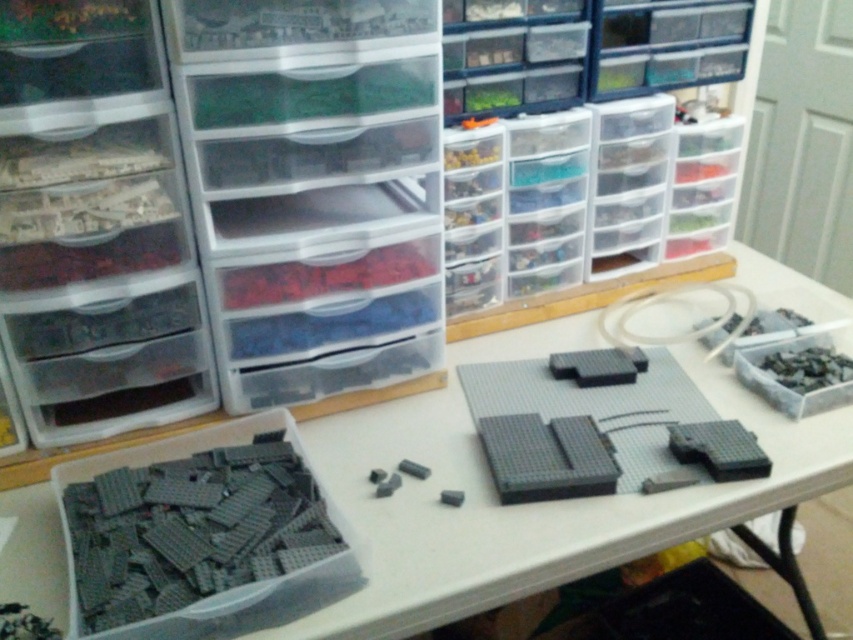
Question: Can you confirm if transparent plastic table at center is positioned below gray matte lego bricks at lower left?

Choices:
 (A) no
 (B) yes

Answer: (A)

Question: Does transparent plastic table at center have a larger size compared to gray matte lego bricks at lower left?

Choices:
 (A) yes
 (B) no

Answer: (A)

Question: Does transparent plastic table at center have a lesser width compared to gray matte lego bricks at lower left?

Choices:
 (A) no
 (B) yes

Answer: (A)

Question: Which of the following is the farthest from the observer?

Choices:
 (A) transparent plastic table at center
 (B) gray matte lego bricks at lower left

Answer: (A)

Question: Which point is closer to the camera?

Choices:
 (A) (48, 592)
 (B) (270, 596)

Answer: (B)